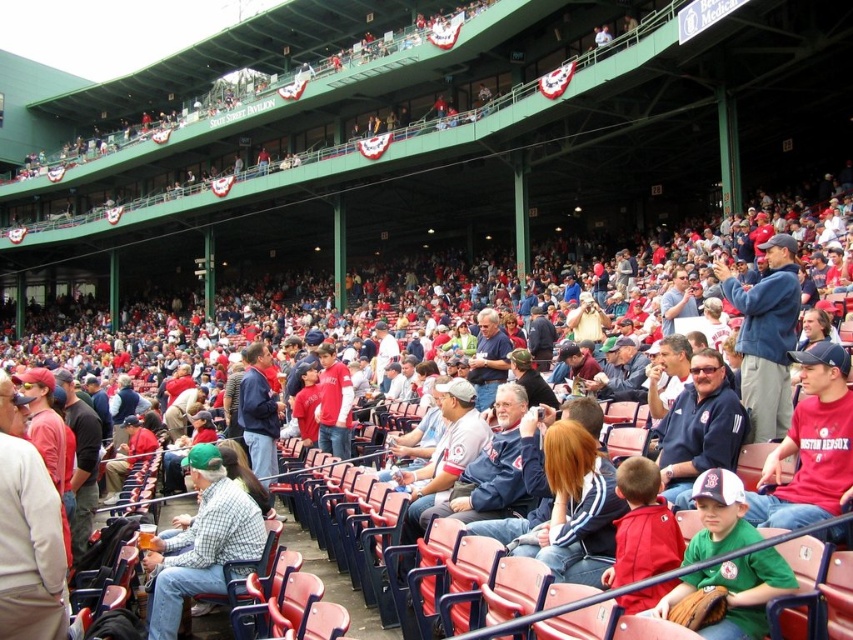
You are a photographer at the baseball stadium and want to capture a photo of both the checkered fabric shirt at center and the green jersey at center. Which shirt should you adjust your camera to focus on first if you want to include both in the frame without moving the camera?

The checkered fabric shirt at center is to the left of the green jersey at center, so you should focus on the checkered fabric shirt at center first to ensure both are in the frame without moving the camera.

You are a photographer at the baseball stadium and want to capture a photo of the checkered fabric shirt at center without the green jersey at center blocking it. How should you adjust your camera angle?

The checkered fabric shirt at center is below the green jersey at center, so you can lower your camera angle to capture the checkered fabric shirt at center without the green jersey at center blocking it.